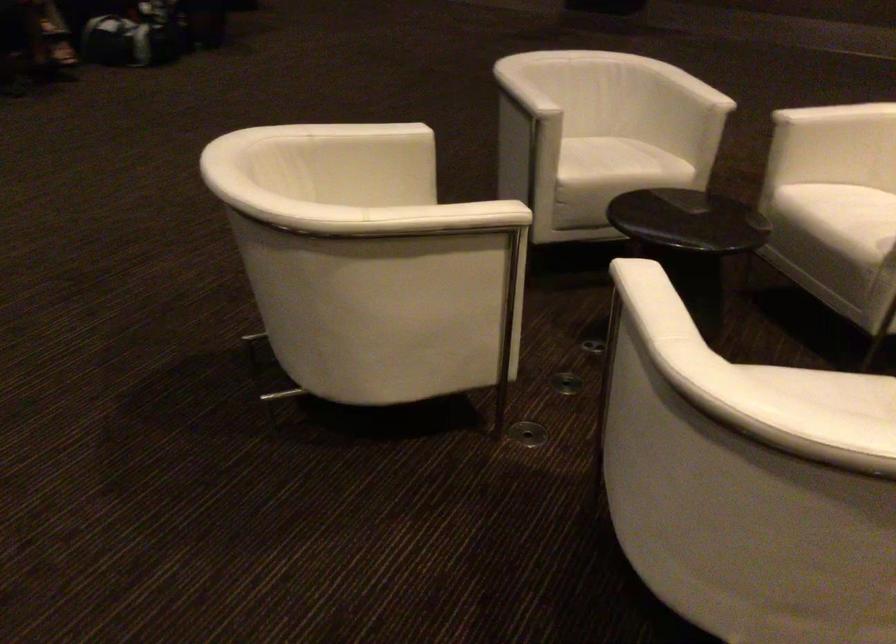
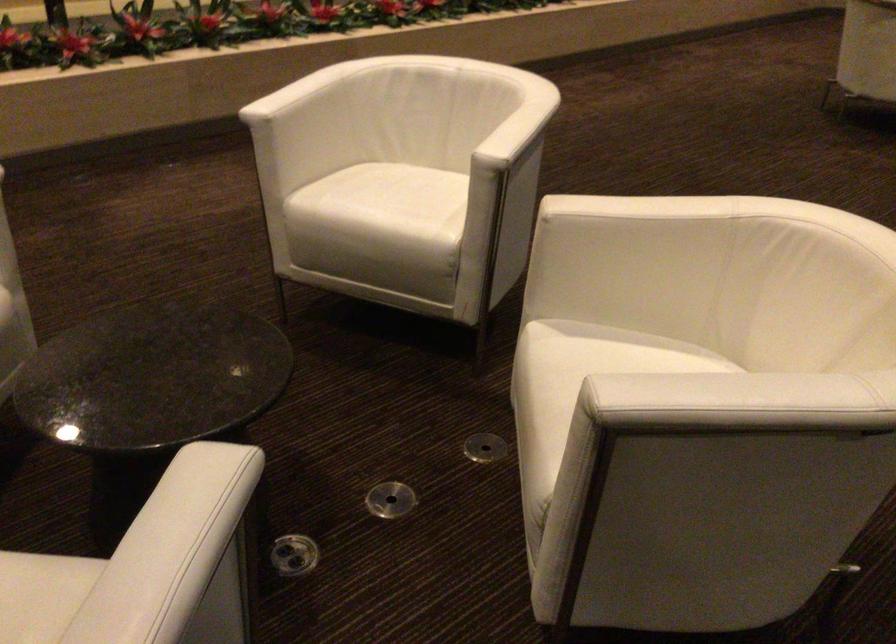
Find the pixel in the second image that matches [778,375] in the first image.

(383, 205)